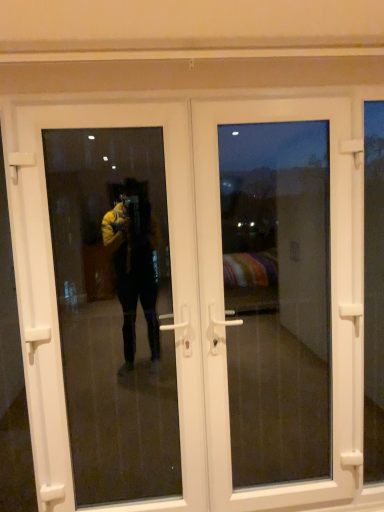
Question: Is white plastic door at center, which ranks as the second door in left-to-right order, at the left side of transparent glass door at left?

Choices:
 (A) no
 (B) yes

Answer: (A)

Question: From the image's perspective, is white plastic door at center, which ranks as the second door in left-to-right order, over transparent glass door at left?

Choices:
 (A) yes
 (B) no

Answer: (A)

Question: Can you confirm if white plastic door at center, which ranks as the second door in left-to-right order, is thinner than transparent glass door at left?

Choices:
 (A) yes
 (B) no

Answer: (B)

Question: Is white plastic door at center, which ranks as the 1th door in right-to-left order, located outside transparent glass door at left?

Choices:
 (A) yes
 (B) no

Answer: (A)

Question: Is the depth of white plastic door at center, which ranks as the second door in left-to-right order, less than that of transparent glass door at left?

Choices:
 (A) yes
 (B) no

Answer: (B)

Question: Would you say white plastic door at center, which ranks as the 1th door in right-to-left order, is to the left or to the right of white plastic door at center, positioned as the 2th door in right-to-left order, in the picture?

Choices:
 (A) right
 (B) left

Answer: (A)

Question: In the image, is white plastic door at center, which ranks as the second door in left-to-right order, positioned in front of or behind white plastic door at center, positioned as the 2th door in right-to-left order?

Choices:
 (A) behind
 (B) front

Answer: (A)

Question: In terms of size, does white plastic door at center, which ranks as the 1th door in right-to-left order, appear bigger or smaller than white plastic door at center, positioned as the 2th door in right-to-left order?

Choices:
 (A) small
 (B) big

Answer: (A)

Question: Which is correct: white plastic door at center, which ranks as the 1th door in right-to-left order, is inside white plastic door at center, positioned as the 2th door in right-to-left order, or outside of it?

Choices:
 (A) outside
 (B) inside

Answer: (B)

Question: Considering the positions of point (168, 163) and point (170, 437), is point (168, 163) closer or farther from the camera than point (170, 437)?

Choices:
 (A) closer
 (B) farther

Answer: (A)

Question: In terms of size, does white plastic door at center, positioned as the first door in left-to-right order, appear bigger or smaller than transparent glass door at left?

Choices:
 (A) big
 (B) small

Answer: (A)

Question: Is white plastic door at center, positioned as the first door in left-to-right order, in front of or behind transparent glass door at left in the image?

Choices:
 (A) front
 (B) behind

Answer: (B)

Question: From a real-world perspective, is white plastic door at center, positioned as the 2th door in right-to-left order, above or below transparent glass door at left?

Choices:
 (A) above
 (B) below

Answer: (B)

Question: Is white plastic door at center, positioned as the 2th door in right-to-left order, to the left or to the right of white plastic door at center, which ranks as the second door in left-to-right order, in the image?

Choices:
 (A) left
 (B) right

Answer: (A)

Question: In terms of height, does white plastic door at center, positioned as the first door in left-to-right order, look taller or shorter compared to white plastic door at center, which ranks as the second door in left-to-right order?

Choices:
 (A) short
 (B) tall

Answer: (A)